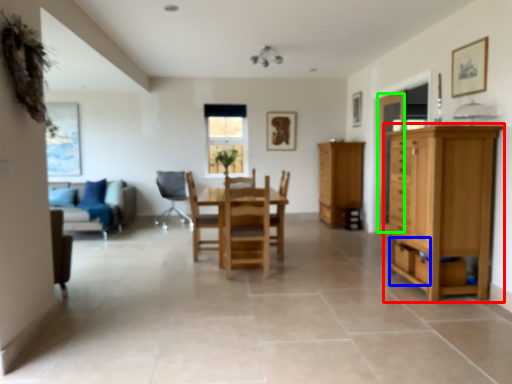
Question: Which object is positioned farthest from cupboard (highlighted by a red box)? Select from drawer (highlighted by a blue box) and glass door (highlighted by a green box).

Choices:
 (A) drawer
 (B) glass door

Answer: (B)